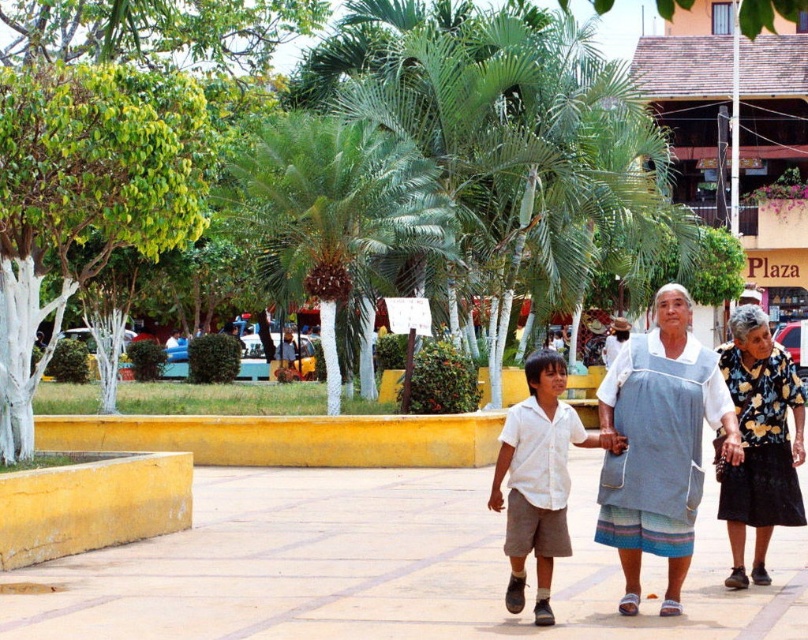
Question: Can you confirm if smooth concrete pavement at center is wider than white cotton shirt at center?

Choices:
 (A) no
 (B) yes

Answer: (A)

Question: Can you confirm if floral print fabric skirt at right is smaller than blue fabric shirt at center?

Choices:
 (A) yes
 (B) no

Answer: (A)

Question: Estimate the real-world distances between objects in this image. Which object is closer to the blue fabric shirt at center?

Choices:
 (A) floral print fabric skirt at right
 (B) white cotton shirt at center
 (C) smooth concrete pavement at center
 (D) light blue fabric apron at center

Answer: (A)

Question: Which point appears closest to the camera in this image?

Choices:
 (A) (553, 467)
 (B) (291, 353)

Answer: (A)

Question: Does green leafy palm tree at center appear on the right side of white cotton shirt at center?

Choices:
 (A) yes
 (B) no

Answer: (B)

Question: Which point is farther to the camera?

Choices:
 (A) floral print fabric skirt at right
 (B) blue fabric shirt at center
 (C) light blue fabric apron at center

Answer: (B)